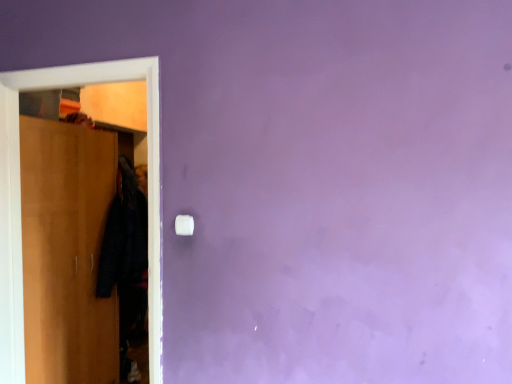
Question: Does white plastic light switch at center lie in front of black fabric coat at left?

Choices:
 (A) no
 (B) yes

Answer: (B)

Question: Does white plastic light switch at center appear on the left side of black fabric coat at left?

Choices:
 (A) no
 (B) yes

Answer: (A)

Question: Can you confirm if white plastic light switch at center is shorter than black fabric coat at left?

Choices:
 (A) no
 (B) yes

Answer: (B)

Question: Could you tell me if white plastic light switch at center is turned towards black fabric coat at left?

Choices:
 (A) no
 (B) yes

Answer: (A)

Question: Would you say white plastic light switch at center is outside black fabric coat at left?

Choices:
 (A) yes
 (B) no

Answer: (A)

Question: From the image's perspective, is white plastic light switch at center over black fabric coat at left?

Choices:
 (A) yes
 (B) no

Answer: (A)

Question: Does black fabric coat at left have a lesser width compared to wooden wardrobe at left?

Choices:
 (A) no
 (B) yes

Answer: (B)

Question: Is wooden wardrobe at left surrounded by black fabric coat at left?

Choices:
 (A) no
 (B) yes

Answer: (A)

Question: Is the surface of black fabric coat at left in direct contact with wooden wardrobe at left?

Choices:
 (A) no
 (B) yes

Answer: (A)

Question: Is the depth of black fabric coat at left less than that of wooden wardrobe at left?

Choices:
 (A) no
 (B) yes

Answer: (A)

Question: Can you confirm if black fabric coat at left is smaller than wooden wardrobe at left?

Choices:
 (A) yes
 (B) no

Answer: (A)

Question: Is black fabric coat at left oriented towards wooden wardrobe at left?

Choices:
 (A) no
 (B) yes

Answer: (A)

Question: Considering the relative sizes of wooden wardrobe at left and white plastic light switch at center in the image provided, is wooden wardrobe at left wider than white plastic light switch at center?

Choices:
 (A) no
 (B) yes

Answer: (B)